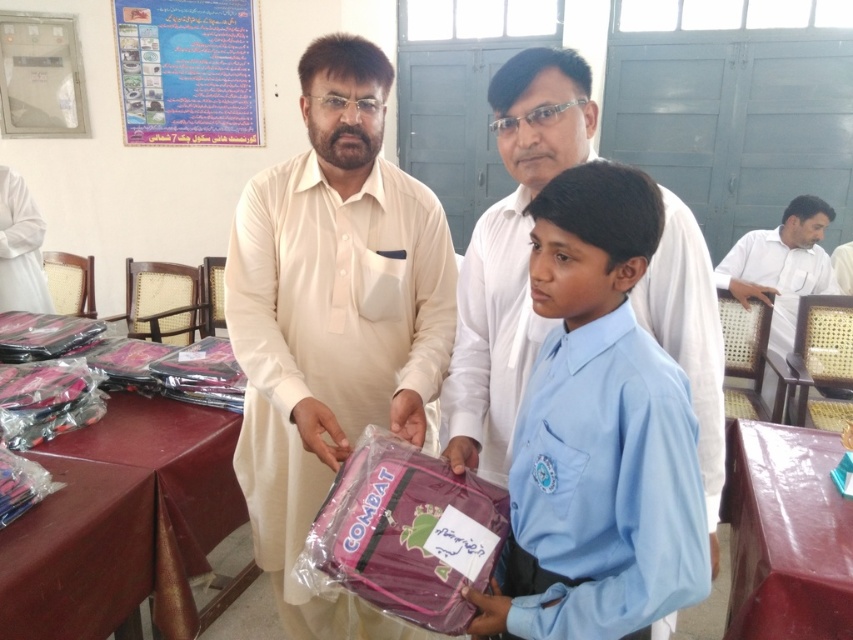
You are a student in the classroom and need to place your purple fabric backpack at center onto the smooth brown table at lower right. Can you easily move it there without moving any other objects?

The purple fabric backpack at center is to the left of the smooth brown table at lower right, so you can easily move it there without moving other objects since there is space between them.

You are a student in the classroom who wants to hand over the pink matte backpack at center to the teacher standing at the front. However, you notice the light blue cotton shirt at center is blocking your path. Based on their positions, can you easily pass the backpack without moving the shirt?

The pink matte backpack at center is below the light blue cotton shirt at center, so you cannot easily pass the backpack without moving the shirt since the shirt is above the backpack and blocking the path.